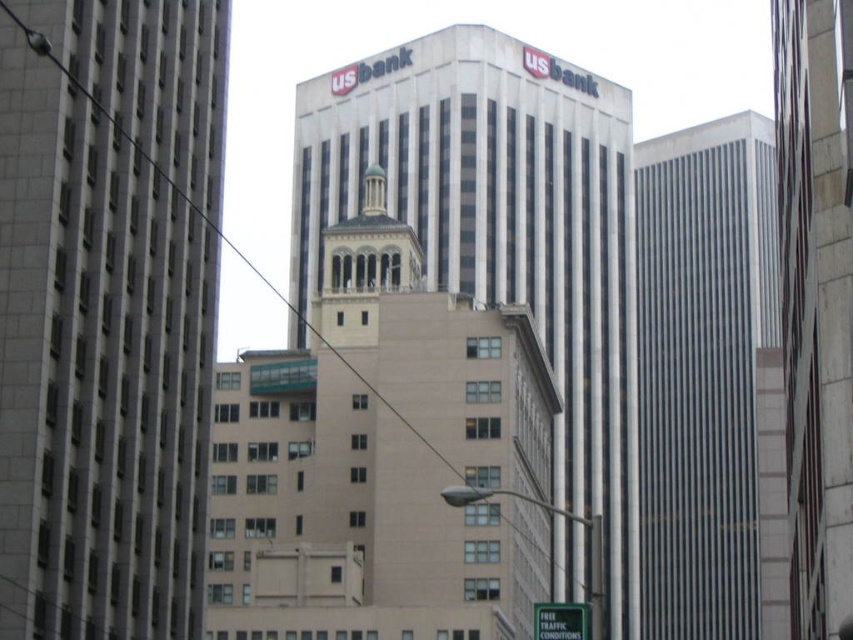
Is gray concrete skyscraper at center in front of white glass building at center?

Yes.

Which is behind, point (78, 438) or point (444, 248)?

Point (444, 248)

Locate an element on the screen. The height and width of the screenshot is (640, 853). gray concrete skyscraper at center is located at coordinates (107, 310).

Between gray concrete skyscraper at center and green matte traffic sign at lower center, which one has more height?

With more height is gray concrete skyscraper at center.

Can you confirm if gray concrete skyscraper at center is positioned above green matte traffic sign at lower center?

Yes, gray concrete skyscraper at center is above green matte traffic sign at lower center.

Where is `gray concrete skyscraper at center`? This screenshot has height=640, width=853. gray concrete skyscraper at center is located at coordinates (107, 310).

Can you confirm if white glass building at center is shorter than green matte traffic sign at lower center?

Incorrect, white glass building at center's height does not fall short of green matte traffic sign at lower center's.

Between white glass building at center and green matte traffic sign at lower center, which one is positioned higher?

Positioned higher is white glass building at center.

The image size is (853, 640). What do you see at coordinates (498, 228) in the screenshot? I see `white glass building at center` at bounding box center [498, 228].

The height and width of the screenshot is (640, 853). Identify the location of white glass building at center. (498, 228).